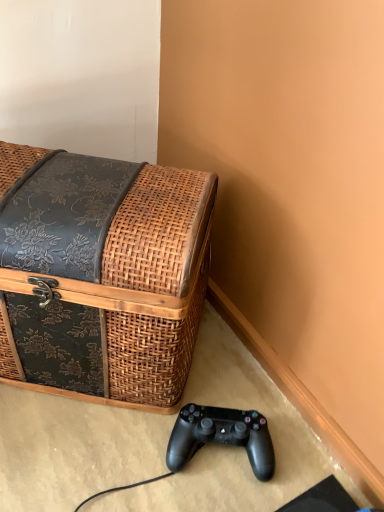
Identify the location of free location to the left of black matte game controller at lower center. (107, 449).